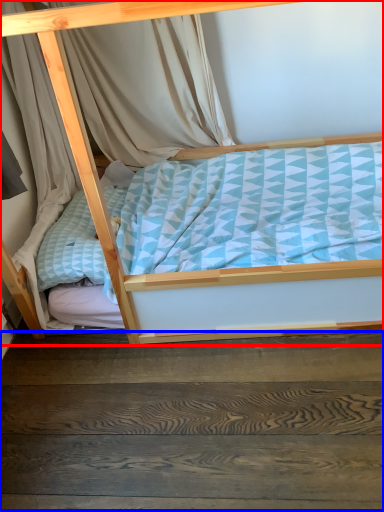
Question: Which of the following is the closest to the observer, bed (highlighted by a red box) or stairwell (highlighted by a blue box)?

Choices:
 (A) bed
 (B) stairwell

Answer: (A)